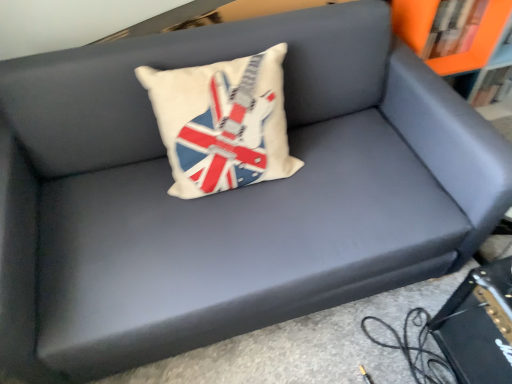
Question: From a real-world perspective, is white fabric pillow with union jack design at center on black leather book at lower right?

Choices:
 (A) no
 (B) yes

Answer: (B)

Question: Is black leather book at lower right surrounded by white fabric pillow with union jack design at center?

Choices:
 (A) no
 (B) yes

Answer: (A)

Question: From a real-world perspective, is white fabric pillow with union jack design at center located beneath black leather book at lower right?

Choices:
 (A) no
 (B) yes

Answer: (A)

Question: Does white fabric pillow with union jack design at center come in front of black leather book at lower right?

Choices:
 (A) yes
 (B) no

Answer: (B)

Question: From the image's perspective, is white fabric pillow with union jack design at center on top of black leather book at lower right?

Choices:
 (A) yes
 (B) no

Answer: (A)

Question: Is point (234, 109) closer or farther from the camera than point (473, 352)?

Choices:
 (A) farther
 (B) closer

Answer: (B)

Question: Is white fabric pillow with union jack design at center inside the boundaries of black leather book at lower right, or outside?

Choices:
 (A) outside
 (B) inside

Answer: (A)

Question: From a real-world perspective, relative to black leather book at lower right, is white fabric pillow with union jack design at center vertically above or below?

Choices:
 (A) above
 (B) below

Answer: (A)

Question: Is white fabric pillow with union jack design at center in front of or behind black leather book at lower right in the image?

Choices:
 (A) behind
 (B) front

Answer: (A)

Question: Considering the positions of orange matte bookcase at upper right and white fabric pillow with union jack design at center in the image, is orange matte bookcase at upper right bigger or smaller than white fabric pillow with union jack design at center?

Choices:
 (A) big
 (B) small

Answer: (A)

Question: Would you say orange matte bookcase at upper right is inside or outside white fabric pillow with union jack design at center?

Choices:
 (A) inside
 (B) outside

Answer: (B)

Question: Considering the positions of point (498, 11) and point (291, 162), is point (498, 11) closer or farther from the camera than point (291, 162)?

Choices:
 (A) farther
 (B) closer

Answer: (A)

Question: Is orange matte bookcase at upper right in front of or behind white fabric pillow with union jack design at center in the image?

Choices:
 (A) front
 (B) behind

Answer: (B)

Question: Is orange matte bookshelf at upper right inside or outside of black leather book at lower right?

Choices:
 (A) outside
 (B) inside

Answer: (A)

Question: Looking at the image, does orange matte bookshelf at upper right seem bigger or smaller compared to black leather book at lower right?

Choices:
 (A) small
 (B) big

Answer: (A)